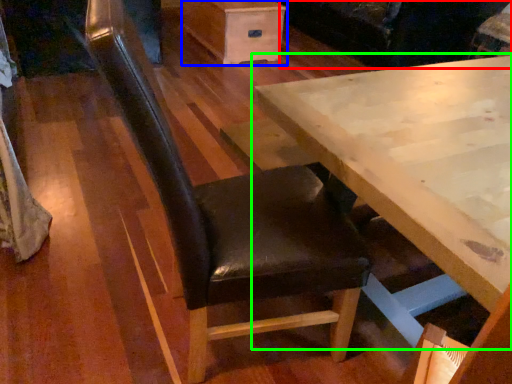
Question: Which object is the closest to the couch (highlighted by a red box)? Choose among these: drawer (highlighted by a blue box) or table (highlighted by a green box).

Choices:
 (A) drawer
 (B) table

Answer: (A)